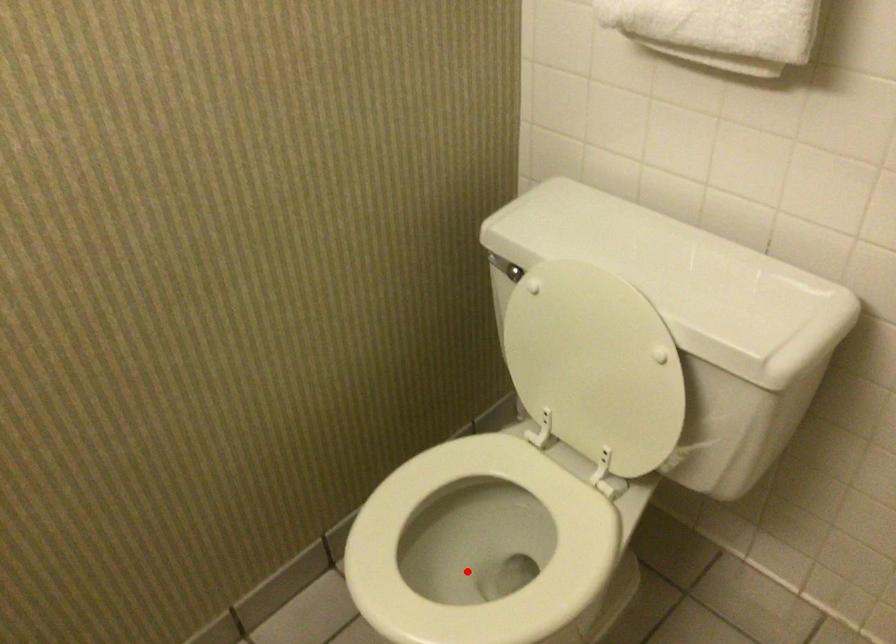
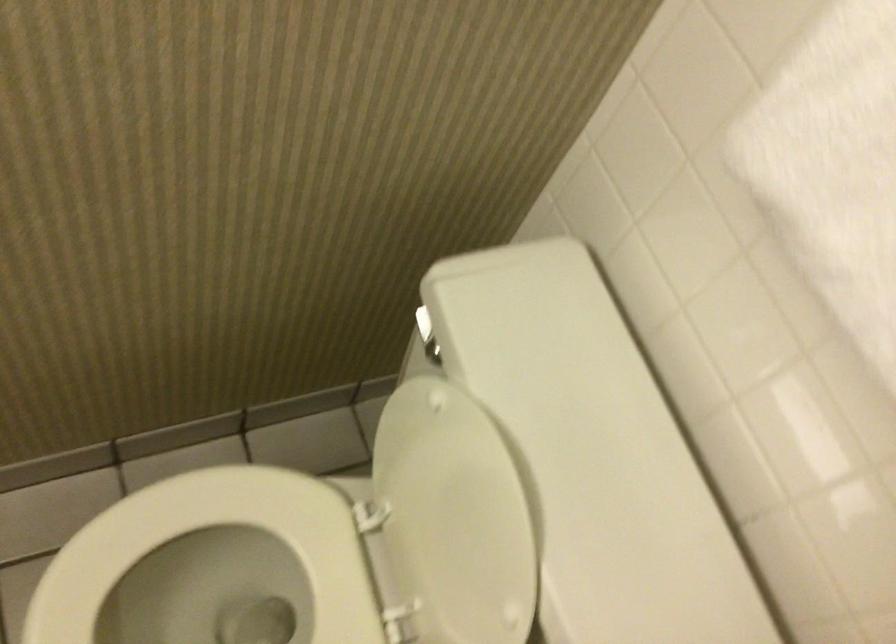
Question: I am providing you with two images of the same scene from different viewpoints. Image1 has a red point marked. In image2, the corresponding 3D location appears at what relative position? Reply with the corresponding letter.

Choices:
 (A) Closer
 (B) Farther

Answer: (A)